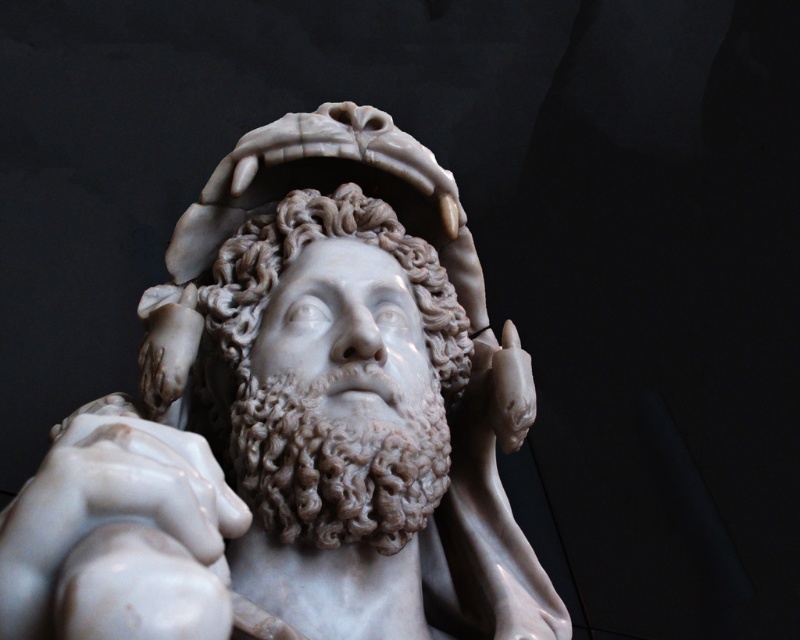
You are an art student standing in front of the white marble statue at center and the white marble head at center. Which object is positioned closer to you?

The white marble statue at center is closer to the viewer than the white marble head at center.

You are an art student analyzing the statue. You need to determine which part of the statue is larger in size between the white marble statue at center and the white marble head at center. Which one is bigger?

The white marble statue at center is bigger than the white marble head at center.

You are an art conservator examining the marble statue. You notice a small crack at point (296,420). Based on the statue description, where is this crack located?

The point (296,420) indicates the white marble statue at center, so the crack is located on the central part of the white marble statue.